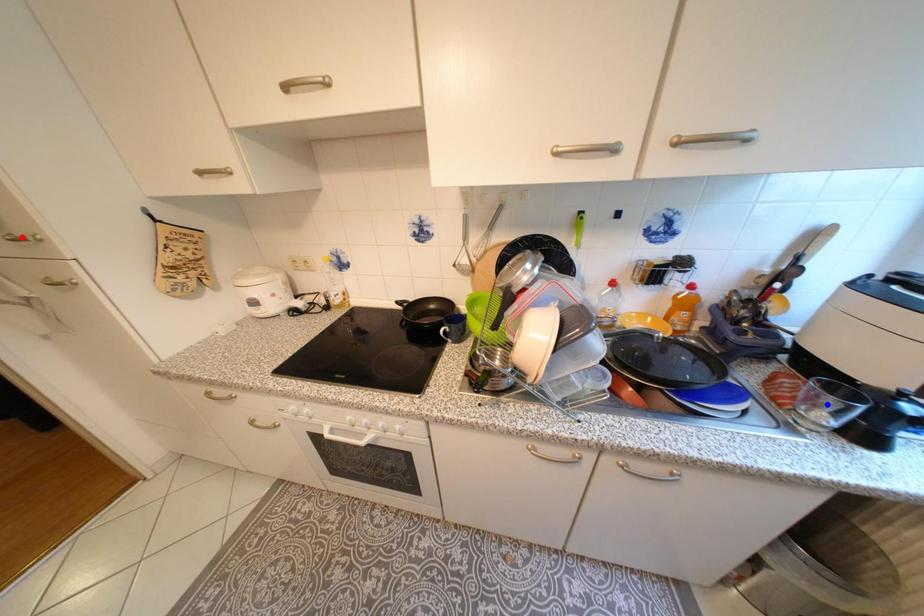
Question: In the image, two points are highlighted. Which point is nearer to the camera? Reply with the corresponding letter.

Choices:
 (A) blue point
 (B) red point

Answer: (A)